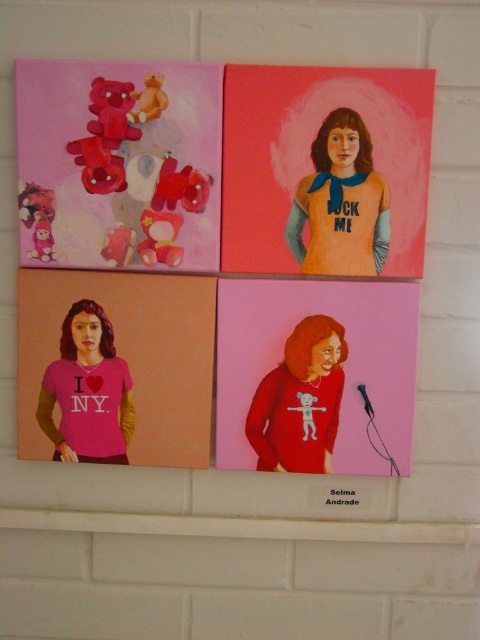
What is located at the point with coordinates (x=119, y=163) in the image?

Matte plastic teddy bears at upper left are located at the point with coordinates (x=119, y=163) in the image.

Looking at the top right painting in the gallery, you see a person wearing two items of clothing. Which clothing item is taller, the matte blue fabric shirt at upper center or the matte red sweater at lower right?

The matte blue fabric shirt at upper center is much taller than the matte red sweater at lower right.